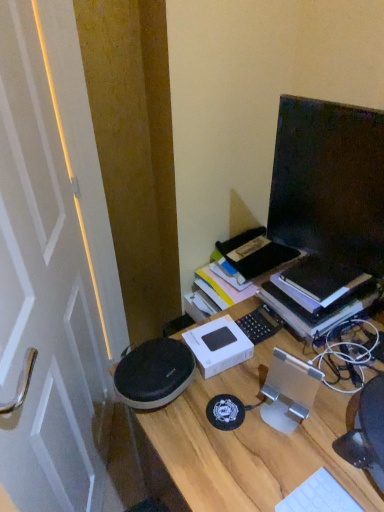
Question: Does point (13, 13) appear closer or farther from the camera than point (332, 396)?

Choices:
 (A) closer
 (B) farther

Answer: (A)

Question: From their relative heights in the image, would you say white glossy door at left is taller or shorter than wooden desk at center?

Choices:
 (A) short
 (B) tall

Answer: (B)

Question: Which is nearer to the hardcover book at right?

Choices:
 (A) wooden desk at center
 (B) white plastic keyboard at lower right
 (C) black glossy monitor at upper right
 (D) white glossy door at left

Answer: (C)

Question: Estimate the real-world distances between objects in this image. Which object is closer to the white glossy door at left?

Choices:
 (A) white plastic keyboard at lower right
 (B) black glossy monitor at upper right
 (C) wooden desk at center
 (D) hardcover book at right

Answer: (C)